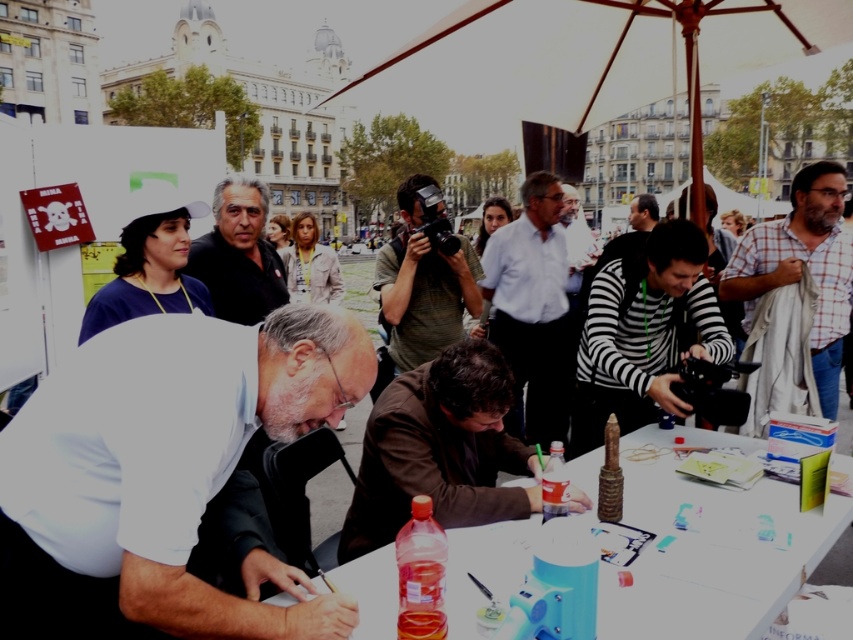
Does white shirt at center appear on the right side of matte black shirt at center?

Correct, you'll find white shirt at center to the right of matte black shirt at center.

Who is more distant from viewer, (527, 196) or (245, 282)?

Positioned behind is point (527, 196).

Where is `white shirt at center`? white shirt at center is located at coordinates (532, 310).

Is white plastic table at center to the right of matte black shirt at center from the viewer's perspective?

Yes, white plastic table at center is to the right of matte black shirt at center.

Is point (666, 477) positioned after point (204, 252)?

That is False.

Where is `white plastic table at center`? The height and width of the screenshot is (640, 853). white plastic table at center is located at coordinates click(x=711, y=561).

Find the location of a particular element. Image resolution: width=853 pixels, height=640 pixels. white plastic table at center is located at coordinates (711, 561).

Is white plastic table at center positioned before striped fabric camera at center?

That is True.

Is point (660, 605) more distant than point (393, 278)?

No, it is in front of (393, 278).

Locate an element on the screen. white plastic table at center is located at coordinates 711,561.